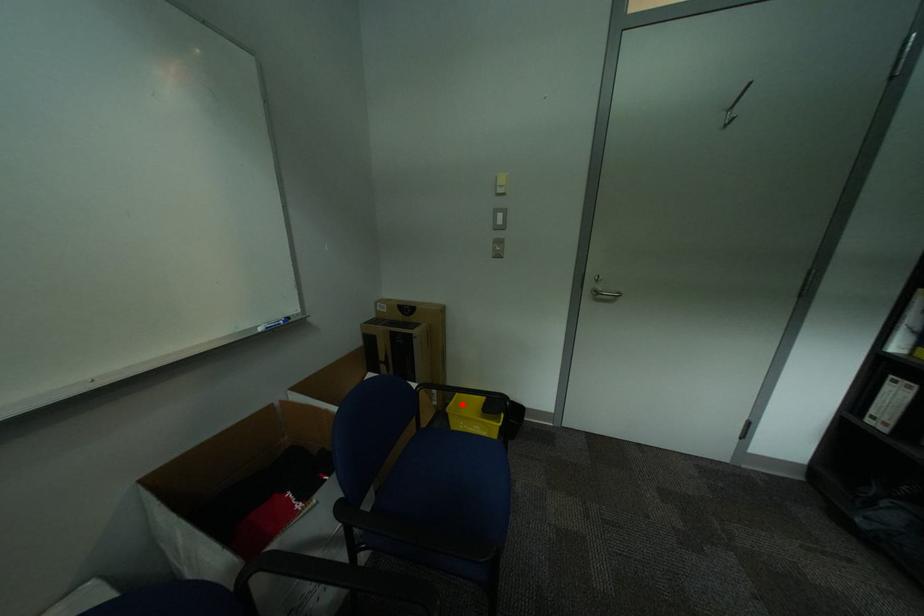
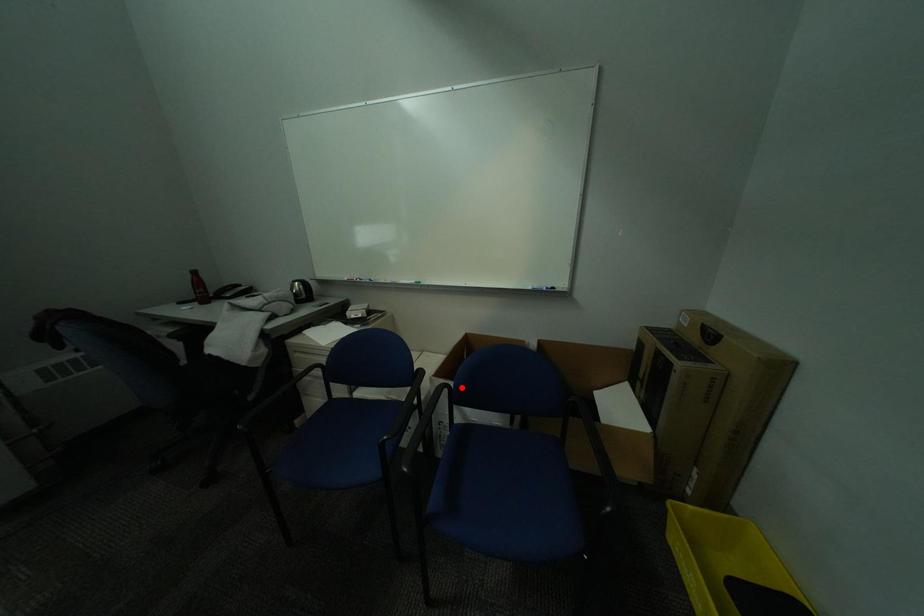
I am providing you with two images of the same scene from different viewpoints. A red point is marked on the first image and another point is marked on the second image. Does the point marked in image1 correspond to the same location as the one in image2?

No